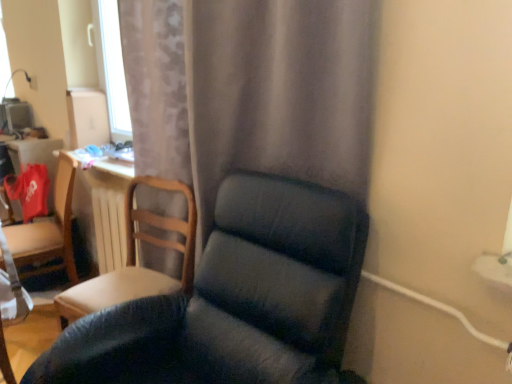
What do you see at coordinates (109, 222) in the screenshot?
I see `white wooden radiator at center` at bounding box center [109, 222].

The height and width of the screenshot is (384, 512). Describe the element at coordinates (32, 82) in the screenshot. I see `white plastic electric outlet at upper left` at that location.

The width and height of the screenshot is (512, 384). Find the location of `matte gray curtain at center`. matte gray curtain at center is located at coordinates (254, 91).

Describe the element at coordinates (236, 300) in the screenshot. This screenshot has width=512, height=384. I see `dark blue fabric chair at center, which is counted as the first chair, starting from the right` at that location.

Locate an element on the screen. This screenshot has width=512, height=384. matte wooden chair at left, the third chair in the front-to-back sequence is located at coordinates (49, 230).

From a real-world perspective, is matte gray curtain at center positioned above or below white plastic electric outlet at upper left?

matte gray curtain at center is situated lower than white plastic electric outlet at upper left in the real world.

Is point (202, 7) positioned in front of point (31, 81)?

Yes, point (202, 7) is in front of point (31, 81).

From the picture: Is matte gray curtain at center positioned behind white plastic electric outlet at upper left?

No, matte gray curtain at center is closer to the camera.

Consider the image. Is matte gray curtain at center taller or shorter than white plastic electric outlet at upper left?

Considering their sizes, matte gray curtain at center has more height than white plastic electric outlet at upper left.

Based on the photo, would you say matte wooden chair at left, marked as the 1th chair in a back-to-front arrangement, is to the left or to the right of white plastic electric outlet at upper left in the picture?

From the image, it's evident that matte wooden chair at left, marked as the 1th chair in a back-to-front arrangement, is to the right of white plastic electric outlet at upper left.

Considering the sizes of objects matte wooden chair at left, marked as the 1th chair in a back-to-front arrangement, and white plastic electric outlet at upper left in the image provided, who is thinner, matte wooden chair at left, marked as the 1th chair in a back-to-front arrangement, or white plastic electric outlet at upper left?

white plastic electric outlet at upper left.

From the image's perspective, is matte wooden chair at left, the third chair in the front-to-back sequence, positioned above or below white plastic electric outlet at upper left?

matte wooden chair at left, the third chair in the front-to-back sequence, is situated lower than white plastic electric outlet at upper left in the image.

How different are the orientations of matte wooden chair at left, which appears as the first chair when viewed from the left, and white plastic electric outlet at upper left in degrees?

1.82 degrees separate the facing orientations of matte wooden chair at left, which appears as the first chair when viewed from the left, and white plastic electric outlet at upper left.

Is white plastic electric outlet at upper left thinner than wooden chair at left, which is counted as the 2th chair, starting from the right?

Yes, white plastic electric outlet at upper left is thinner than wooden chair at left, which is counted as the 2th chair, starting from the right.

Does white plastic electric outlet at upper left have a smaller size compared to wooden chair at left, which is counted as the 2th chair, starting from the right?

Yes, white plastic electric outlet at upper left is smaller than wooden chair at left, which is counted as the 2th chair, starting from the right.

Would you say white plastic electric outlet at upper left is inside or outside wooden chair at left, which is the 2th chair from left to right?

white plastic electric outlet at upper left is spatially situated outside wooden chair at left, which is the 2th chair from left to right.

From a real-world perspective, relative to wooden chair at left, arranged as the second chair when viewed from the back, is dark blue fabric chair at center, which is counted as the first chair, starting from the right, vertically above or below?

dark blue fabric chair at center, which is counted as the first chair, starting from the right, is below wooden chair at left, arranged as the second chair when viewed from the back.

Between dark blue fabric chair at center, which is counted as the first chair, starting from the right, and wooden chair at left, which is counted as the 2th chair, starting from the right, which one appears on the right side from the viewer's perspective?

Positioned to the right is dark blue fabric chair at center, which is counted as the first chair, starting from the right.

Based on the photo, which point is more forward, (178,314) or (170,185)?

The point (178,314) is more forward.

Between white wooden radiator at center and white plastic electric outlet at upper left, which one has smaller size?

white plastic electric outlet at upper left.

What are the coordinates of `electric outlet lying on the left of white wooden radiator at center` in the screenshot? It's located at (32, 82).

Considering the positions of objects white wooden radiator at center and white plastic electric outlet at upper left in the image provided, who is behind, white wooden radiator at center or white plastic electric outlet at upper left?

white plastic electric outlet at upper left.

Could you tell me if white wooden radiator at center is facing white plastic electric outlet at upper left?

No, white wooden radiator at center is not oriented towards white plastic electric outlet at upper left.

Which point is more distant from viewer, (x=67, y=294) or (x=287, y=158)?

The point (x=67, y=294) is farther.

Is matte gray curtain at center a part of wooden chair at left, arranged as the second chair when viewed from the front?

No, matte gray curtain at center is located outside of wooden chair at left, arranged as the second chair when viewed from the front.

Visually, is wooden chair at left, which is counted as the 2th chair, starting from the right, positioned to the left or to the right of matte gray curtain at center?

wooden chair at left, which is counted as the 2th chair, starting from the right, is positioned on matte gray curtain at center's left side.

Looking at this image, which of these two, wooden chair at left, arranged as the second chair when viewed from the back, or matte gray curtain at center, is thinner?

matte gray curtain at center is thinner.

Is dark blue fabric chair at center, which is counted as the first chair, starting from the right, further to the viewer compared to white wooden radiator at center?

No, the depth of dark blue fabric chair at center, which is counted as the first chair, starting from the right, is less than that of white wooden radiator at center.

From the image's perspective, which one is positioned higher, dark blue fabric chair at center, the 3th chair positioned from the left, or white wooden radiator at center?

white wooden radiator at center.

Based on the photo, from a real-world perspective, is dark blue fabric chair at center, the 3th chair positioned from the left, positioned over white wooden radiator at center based on gravity?

Yes, from a real-world perspective, dark blue fabric chair at center, the 3th chair positioned from the left, is on top of white wooden radiator at center.

Is dark blue fabric chair at center, which is the third chair in back-to-front order, facing towards white wooden radiator at center?

No, dark blue fabric chair at center, which is the third chair in back-to-front order, is not facing towards white wooden radiator at center.

Locate an element on the screen. This screenshot has height=384, width=512. electric outlet behind the matte gray curtain at center is located at coordinates (32, 82).

Identify the location of electric outlet above the matte wooden chair at left, positioned as the third chair in right-to-left order (from a real-world perspective). (32, 82).

Based on their spatial positions, is matte wooden chair at left, marked as the 1th chair in a back-to-front arrangement, or wooden chair at left, arranged as the second chair when viewed from the back, further from white plastic electric outlet at upper left?

wooden chair at left, arranged as the second chair when viewed from the back, is further to white plastic electric outlet at upper left.

Which object lies further to the anchor point white wooden radiator at center, matte gray curtain at center or matte wooden chair at left, which appears as the first chair when viewed from the left?

matte gray curtain at center lies further to white wooden radiator at center than the other object.

Based on their spatial positions, is matte wooden chair at left, the third chair in the front-to-back sequence, or dark blue fabric chair at center, the 3th chair positioned from the left, further from white wooden radiator at center?

dark blue fabric chair at center, the 3th chair positioned from the left, is positioned further to the anchor white wooden radiator at center.

When comparing their distances from wooden chair at left, which is the 2th chair from left to right, does matte wooden chair at left, marked as the 1th chair in a back-to-front arrangement, or white wooden radiator at center seem further?

matte wooden chair at left, marked as the 1th chair in a back-to-front arrangement.

From the image, which object appears to be farther from wooden chair at left, arranged as the second chair when viewed from the back, dark blue fabric chair at center, the 3th chair positioned from the left, or white plastic electric outlet at upper left?

white plastic electric outlet at upper left is further to wooden chair at left, arranged as the second chair when viewed from the back.

When comparing their distances from wooden chair at left, arranged as the second chair when viewed from the front, does white plastic electric outlet at upper left or dark blue fabric chair at center, which is the first chair from front to back, seem further?

white plastic electric outlet at upper left lies further to wooden chair at left, arranged as the second chair when viewed from the front, than the other object.

Based on their spatial positions, is white plastic electric outlet at upper left or matte gray curtain at center closer to wooden chair at left, arranged as the second chair when viewed from the back?

Among the two, matte gray curtain at center is located nearer to wooden chair at left, arranged as the second chair when viewed from the back.

Which object lies further to the anchor point matte gray curtain at center, dark blue fabric chair at center, which is the first chair from front to back, or wooden chair at left, which is counted as the 2th chair, starting from the right?

wooden chair at left, which is counted as the 2th chair, starting from the right, lies further to matte gray curtain at center than the other object.

Locate an element on the screen. The width and height of the screenshot is (512, 384). radiator between matte gray curtain at center and white plastic electric outlet at upper left from front to back is located at coordinates (109, 222).

This screenshot has height=384, width=512. I want to click on chair between matte gray curtain at center and white wooden radiator at center in the front-back direction, so click(135, 257).

Locate an element on the screen. radiator between dark blue fabric chair at center, which is the third chair in back-to-front order, and white plastic electric outlet at upper left, along the z-axis is located at coordinates (109, 222).

The image size is (512, 384). I want to click on chair that lies between white plastic electric outlet at upper left and white wooden radiator at center from top to bottom, so click(x=49, y=230).